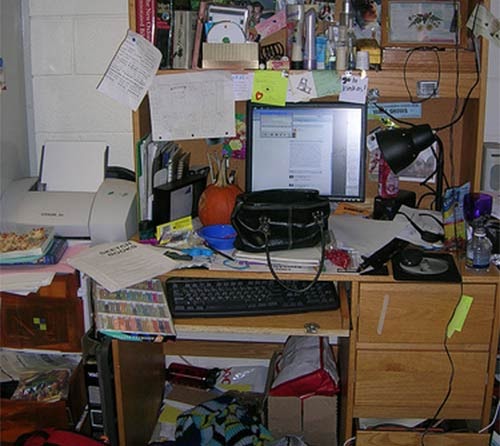
You are a GUI agent. You are given a task and a screenshot of the screen. Output one action in this format:
    pyautogui.click(x=<x>, y=<y>)
    Task: Click on the mousepad
    
    Given the screenshot: What is the action you would take?
    pyautogui.click(x=440, y=274)